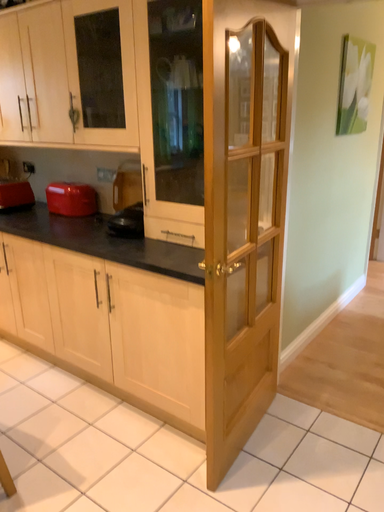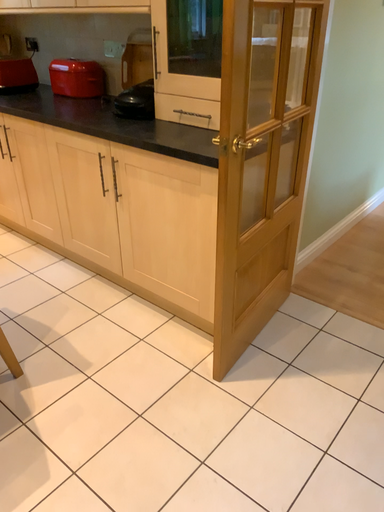
Question: Which way did the camera rotate in the video?

Choices:
 (A) rotated downward
 (B) rotated upward

Answer: (A)